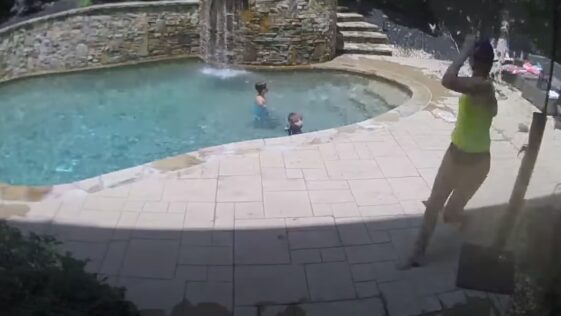
Locate an element on the screen. This screenshot has height=316, width=561. lounge chairs is located at coordinates (539, 70).